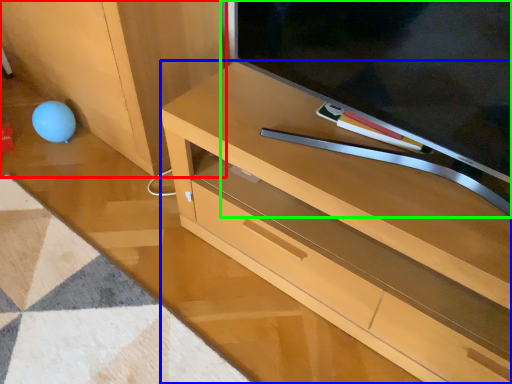
Question: Estimate the real-world distances between objects in this image. Which object is farther from cabinetry (highlighted by a red box), desk (highlighted by a blue box) or television (highlighted by a green box)?

Choices:
 (A) desk
 (B) television

Answer: (B)